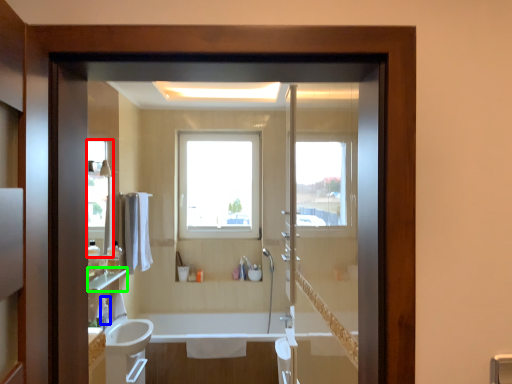
Question: Which object is positioned farthest from mirror (highlighted by a red box)? Select from toiletry (highlighted by a blue box) and balustrade (highlighted by a green box).

Choices:
 (A) toiletry
 (B) balustrade

Answer: (A)